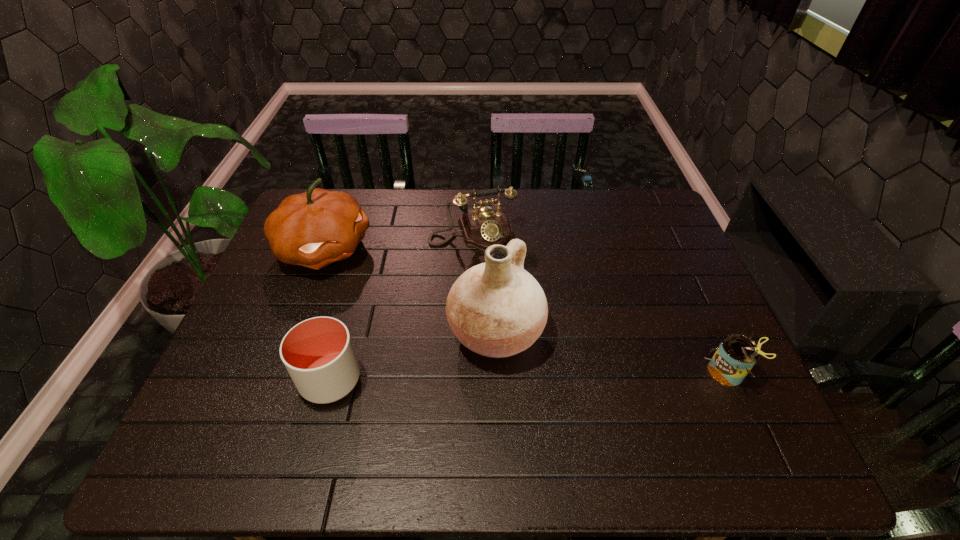
I want to click on vacant space situated on the front face of the second tallest object, so click(432, 311).

Locate an element on the screen. This screenshot has width=960, height=540. free point located 0.110m on the front face of the second tallest object is located at coordinates (386, 284).

The image size is (960, 540). In order to click on vacant space located 0.100m on the front face of the second tallest object in this screenshot , I will do `click(383, 282)`.

Find the location of `vacant space located 0.130m on the dial of the telephone`. vacant space located 0.130m on the dial of the telephone is located at coordinates (493, 282).

The height and width of the screenshot is (540, 960). In order to click on vacant position located on the dial of the telephone in this screenshot , I will do `click(492, 278)`.

Image resolution: width=960 pixels, height=540 pixels. In order to click on vacant space located on the dial of the telephone in this screenshot , I will do click(x=508, y=320).

Identify the location of pumpkin at the far edge. (313, 229).

Locate an element on the screen. This screenshot has width=960, height=540. telephone located in the far edge section of the desktop is located at coordinates (482, 227).

The width and height of the screenshot is (960, 540). Identify the location of cup located in the near edge section of the desktop. (318, 353).

The width and height of the screenshot is (960, 540). I want to click on can at the near edge, so click(x=736, y=355).